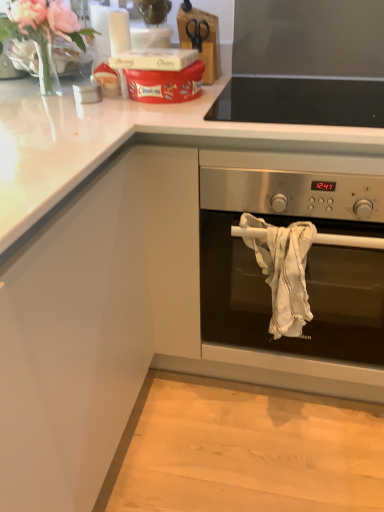
Question: Should I look upward or downward to see black glass cooktop at upper center?

Choices:
 (A) down
 (B) up

Answer: (B)